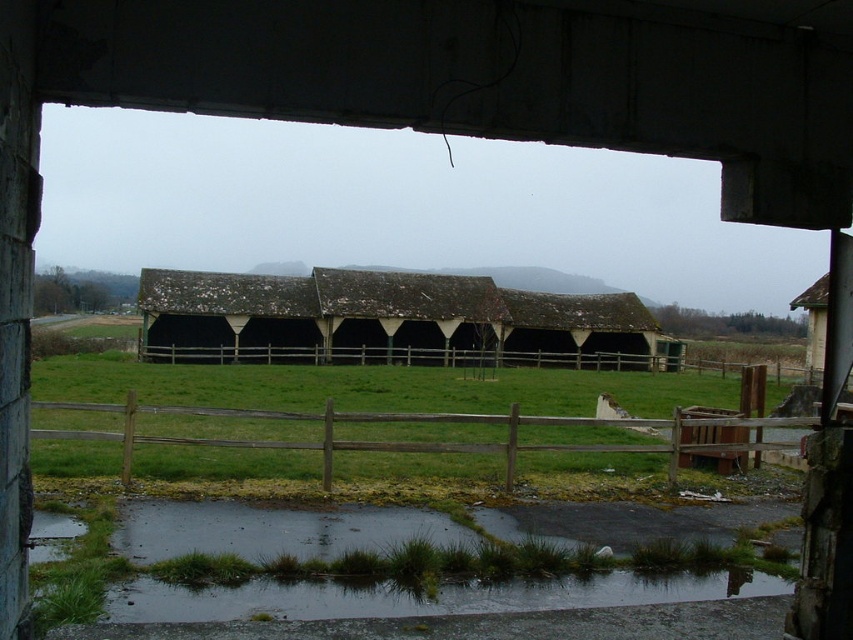
You are standing inside the structure and want to exit through the nearest opening. The rusty metal barn at center and the wooden fence at center are in your way. Which one should you move past first to exit?

The wooden fence at center is below the rusty metal barn at center, so you should move past the wooden fence at center first to exit through the nearest opening.